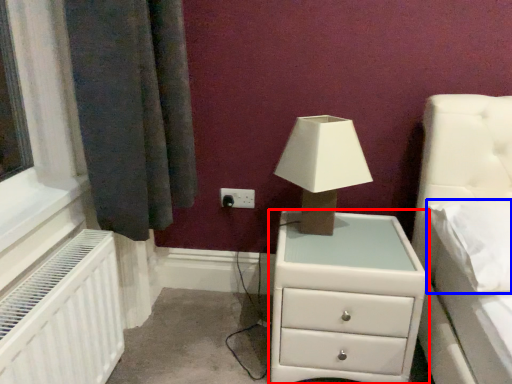
Question: Among these objects, which one is farthest to the camera, chest of drawers (highlighted by a red box) or pillow (highlighted by a blue box)?

Choices:
 (A) chest of drawers
 (B) pillow

Answer: (A)